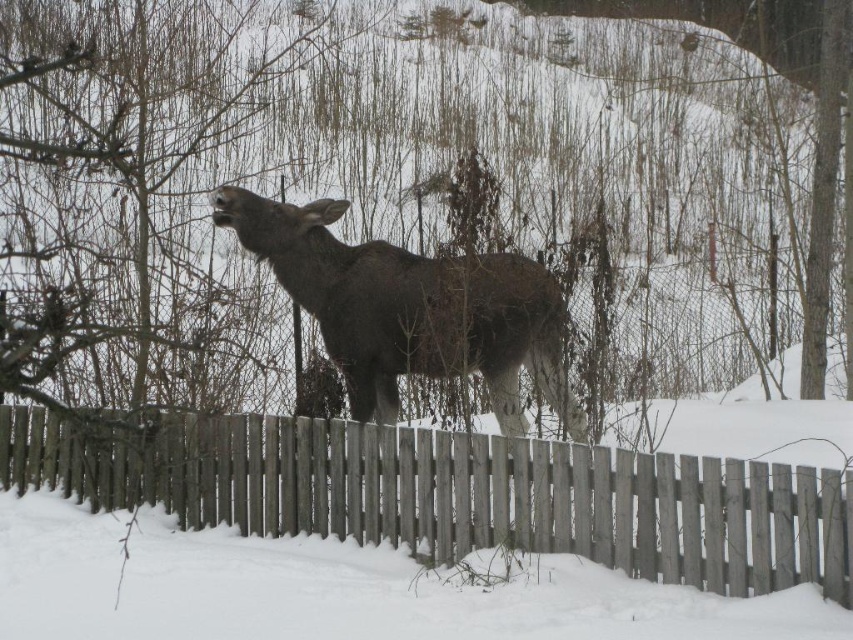
You are a photographer trying to capture the dark brown fur at center of the moose without the wooden picket fence at center blocking the view. Based on their positions, can you move to the right or left to achieve this?

The wooden picket fence at center is to the left of the dark brown fur at center. To avoid the fence blocking the view, you should move to the left side so that the dark brown fur at center is positioned to the right of the fence, allowing it to be visible without obstruction.

From the picture: The moose is behind the wooden picket fence at center. If you were standing at the point marked by the coordinate (x=462, y=493), which object would be directly in front of you?

The wooden picket fence at center is located at the coordinate point (x=462, y=493), so if you were standing there, the fence would be directly in front of you.